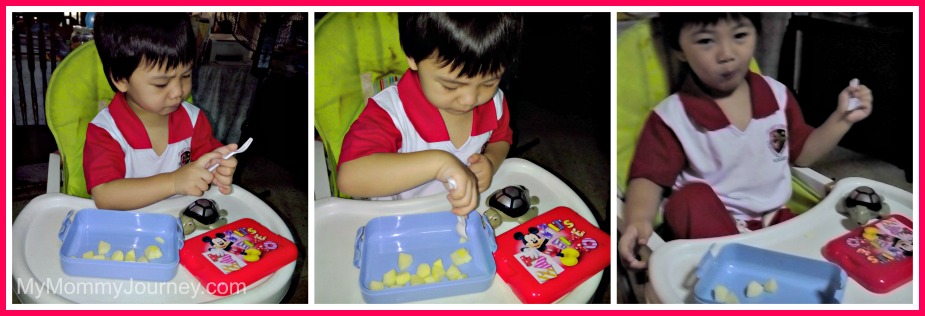
Locate an element on the screen. This screenshot has width=925, height=316. fork is located at coordinates (462, 225).